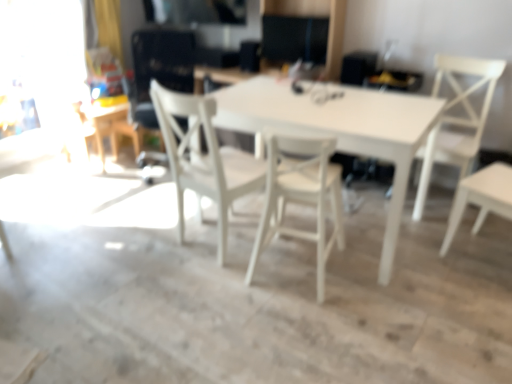
What are the coordinates of `blank area to the left of white wood chair at center, placed as the 3th chair when sorted from right to left` in the screenshot? It's located at (138, 237).